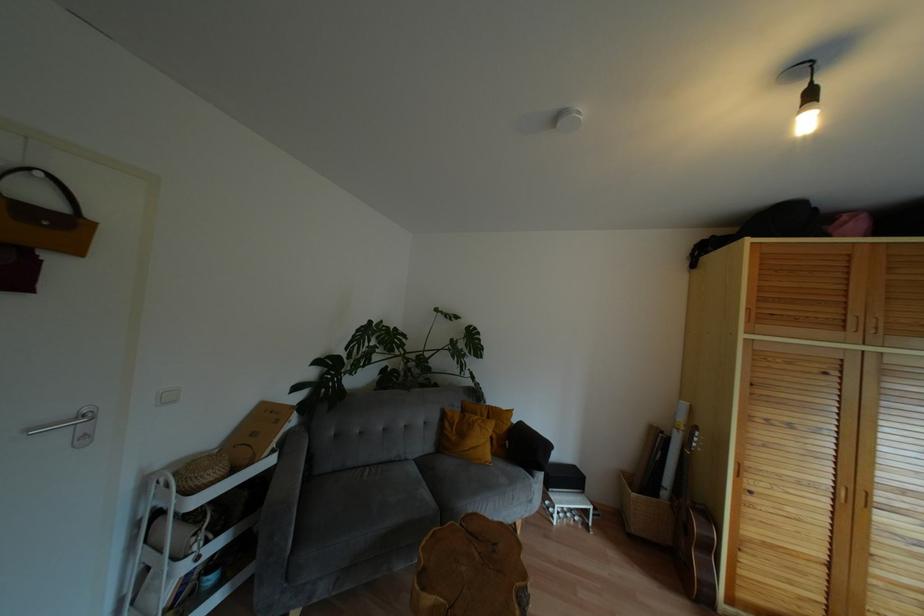
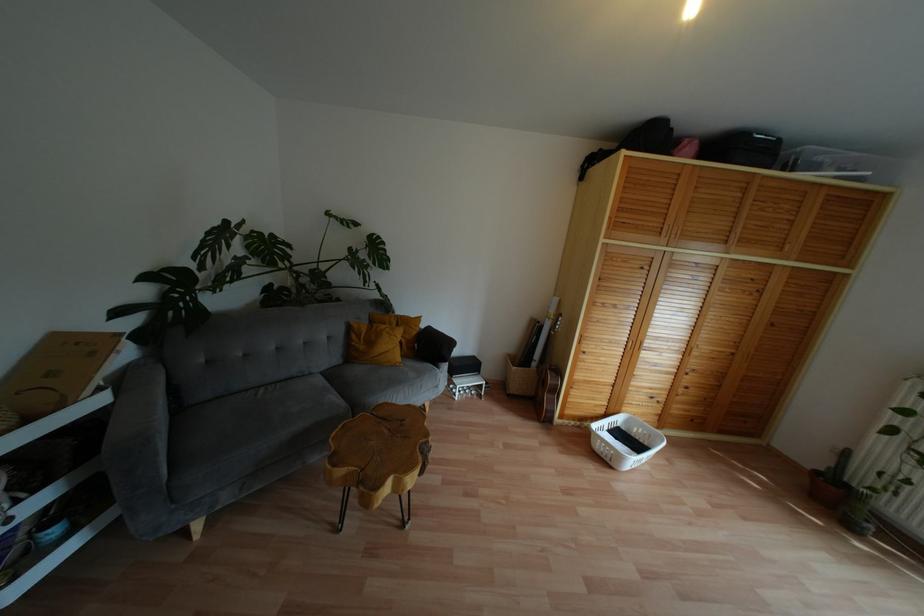
First-person continuous shooting, in which direction is the camera rotating?

Answer: The rotation direction of the camera is right-down.